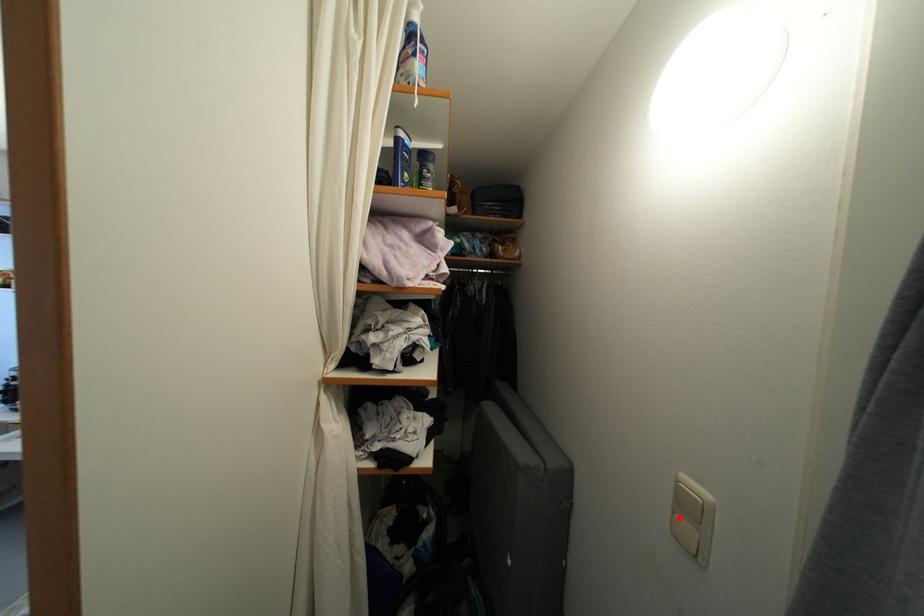
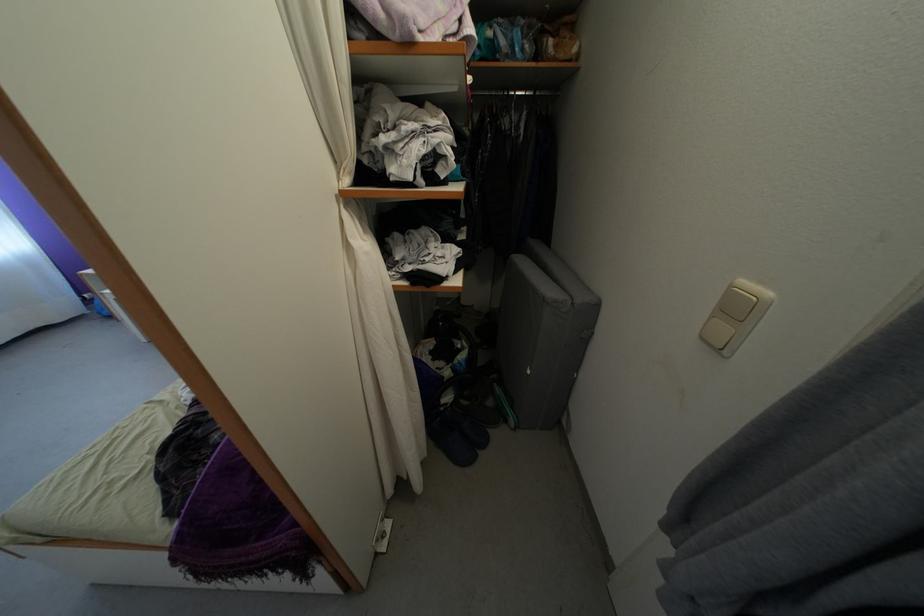
In the second image, find the point that corresponds to the highlighted location in the first image.

(718, 323)